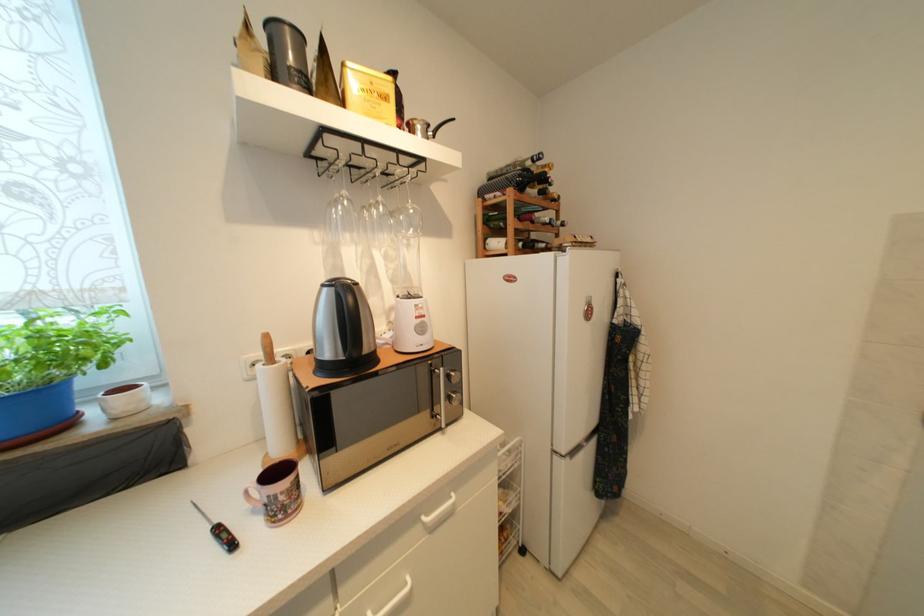
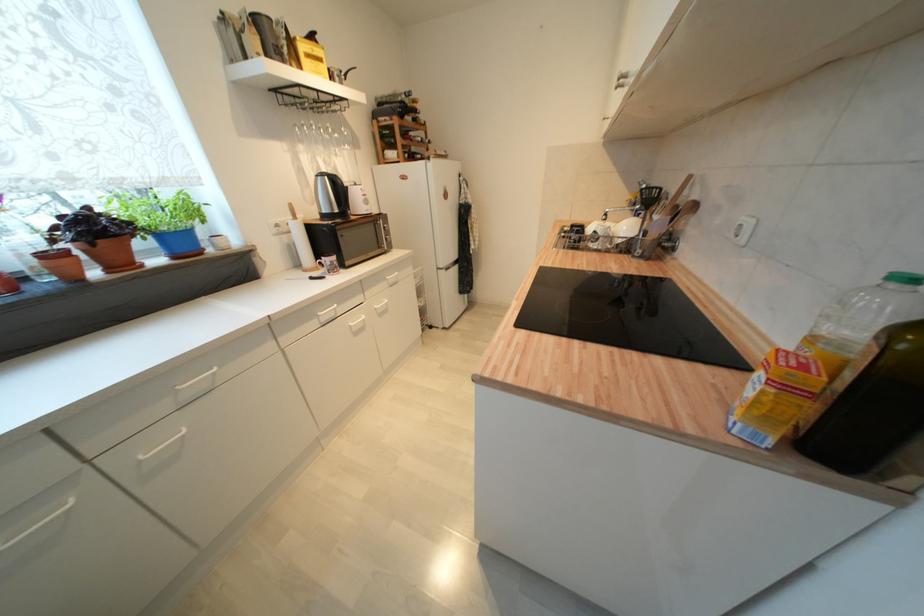
Find the pixel in the second image that matches pixel 237 546 in the first image.

(329, 280)